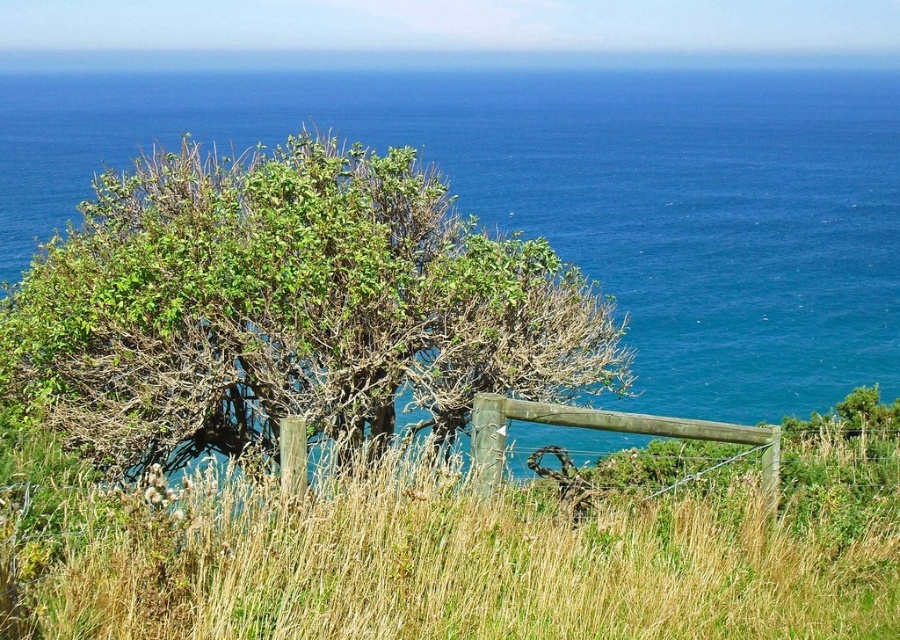
You are a gardener who wants to plant a new flowerbed. You have two options for locations based on the image. The first is near the green grass at center and the second is near the green leafy bush at left. Which location would provide more space for the flowerbed?

The green grass at center has a larger size compared to the green leafy bush at left, so the flowerbed would have more space near the green grass at center.

You are a gardener planning to water the green grass at center and the green leafy bush at left. If your watering can has a range of 15 feet, can you water both plants without moving the can?

The green grass at center and the green leafy bush at left are 15.12 feet apart. Since the watering can has a range of 15 feet, you cannot water both plants without moving the can because the distance exceeds the can range.

You are standing in the coastal landscape and want to walk from the green leafy bush at left to the green grass at center. Which direction should you move?

You should move to the right because the green grass at center is to the right of the green leafy bush at left.